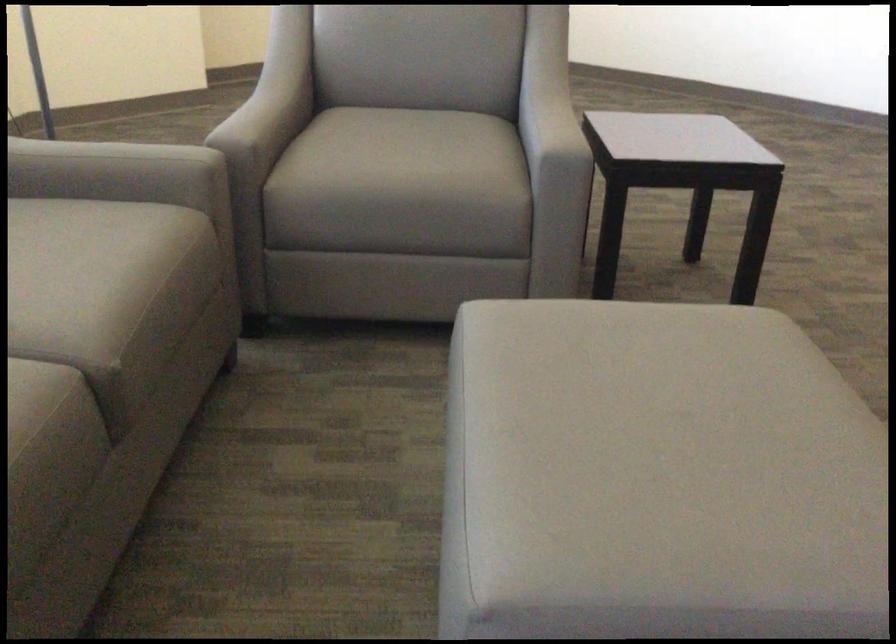
This screenshot has width=896, height=644. Identify the location of sofa sitting surface. (97, 252).